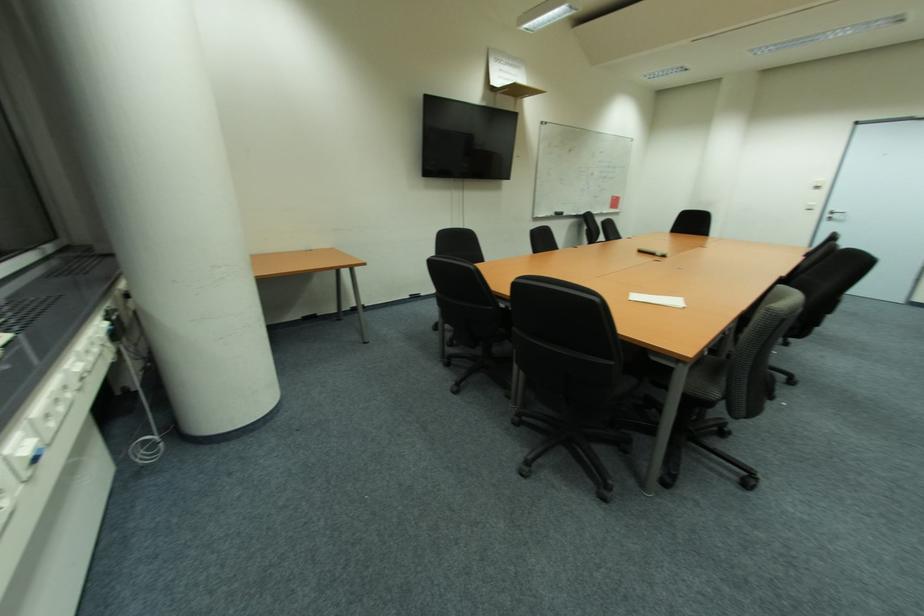
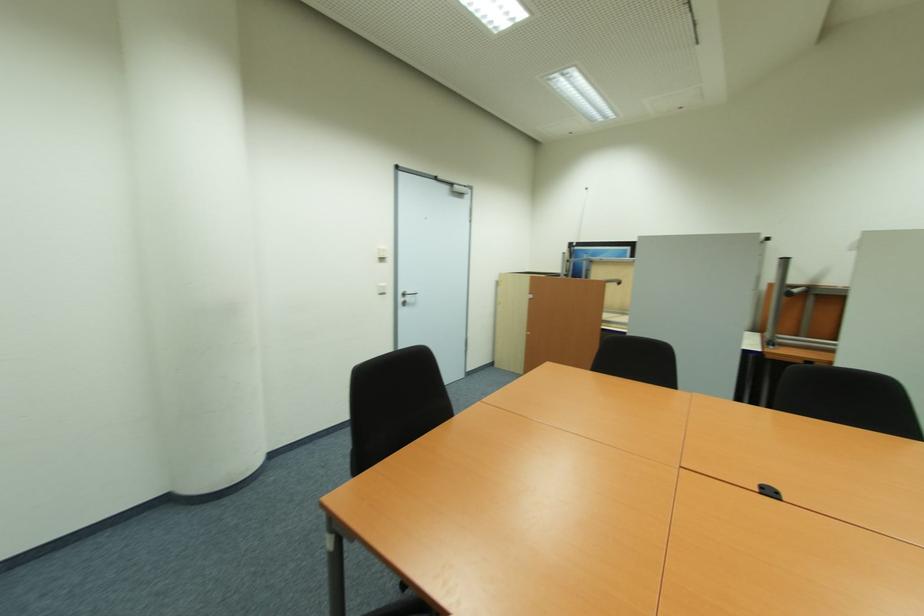
In the second image, find the point that corresponds to (833,217) in the first image.

(405, 300)